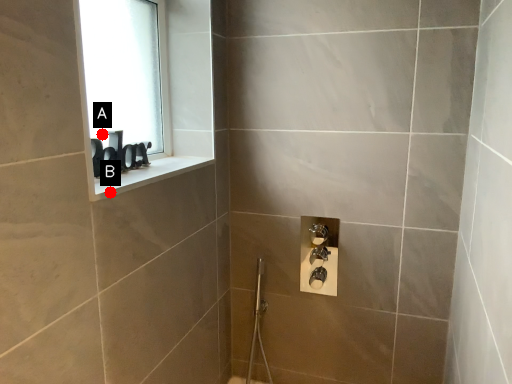
Question: Two points are circled on the image, labeled by A and B beside each circle. Which point is further to the camera?

Choices:
 (A) A is further
 (B) B is further

Answer: (A)